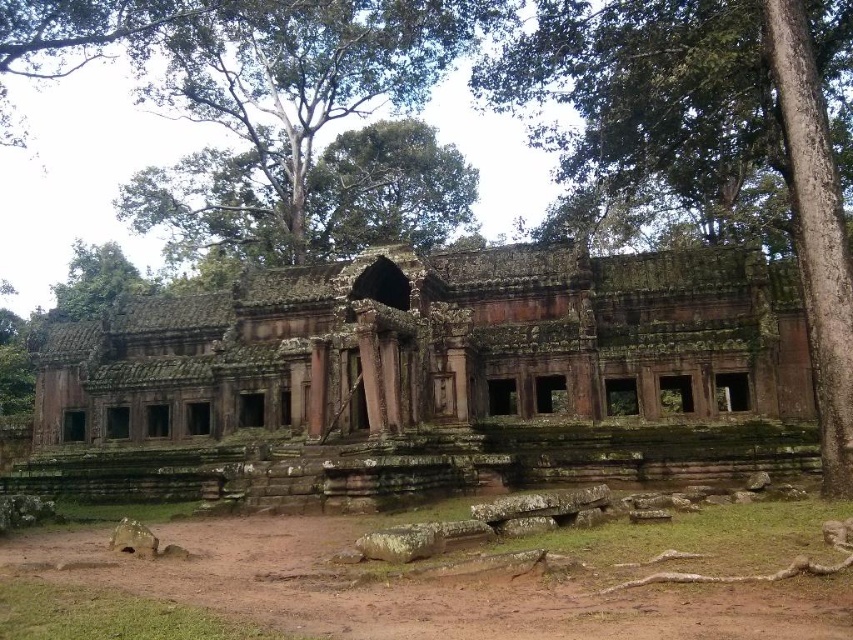
You are an archaeologist standing in front of the pink stone ruins at center and the green leafy tree at upper center. Which object is nearer to you?

The pink stone ruins at center is closer to the viewer than the green leafy tree at upper center.

In the scene shown: You are an archaeologist examining the ancient site. You notice the pink stone ruins at center and the green rough bark tree at upper center. Which object takes up more area in the image?

The green rough bark tree at upper center takes up more area in the image than the pink stone ruins at center.